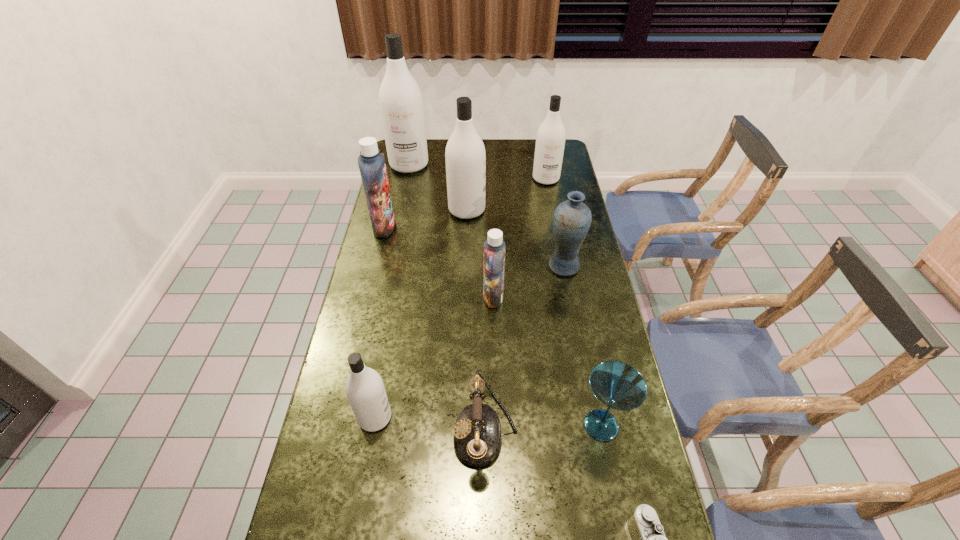
Locate an element on the screen. The image size is (960, 540). vacant space that satisfies the following two spatial constraints: 1. on the front-facing side of the third farthest white shampoo; 2. on the right side of the sixth nearest object is located at coordinates (465, 266).

Find the location of a particular element. free location that satisfies the following two spatial constraints: 1. on the front-facing side of the rightmost white shampoo; 2. on the front label of the bigger blue shampoo is located at coordinates (555, 227).

Find the location of `vacant space that satisfies the following two spatial constraints: 1. on the front-facing side of the biggest white shampoo; 2. on the front label of the farther blue shampoo`. vacant space that satisfies the following two spatial constraints: 1. on the front-facing side of the biggest white shampoo; 2. on the front label of the farther blue shampoo is located at coordinates (396, 227).

Find the location of a particular element. vacant position in the image that satisfies the following two spatial constraints: 1. on the front-facing side of the rightmost white shampoo; 2. on the front label of the bigger blue shampoo is located at coordinates (555, 227).

This screenshot has height=540, width=960. I want to click on free space that satisfies the following two spatial constraints: 1. on the front-facing side of the nearest shampoo; 2. on the right side of the martini, so click(x=373, y=426).

Locate an element on the screen. Image resolution: width=960 pixels, height=540 pixels. free space that satisfies the following two spatial constraints: 1. on the front-facing side of the second smallest white shampoo; 2. on the front-facing side of the nearest white shampoo is located at coordinates (589, 417).

Image resolution: width=960 pixels, height=540 pixels. What are the coordinates of `vacant point that satisfies the following two spatial constraints: 1. on the front-facing side of the third biggest white shampoo; 2. on the front-facing side of the third white shampoo from left to right` in the screenshot? It's located at (552, 210).

You are a GUI agent. You are given a task and a screenshot of the screen. Output one action in this format:
    pyautogui.click(x=<x>, y=<y>)
    Task: Click on the vacant area in the image that satisfies the following two spatial constraints: 1. on the front-facing side of the second smallest white shampoo; 2. on the front label of the fifth farthest shampoo
    
    Given the screenshot: What is the action you would take?
    pyautogui.click(x=567, y=297)